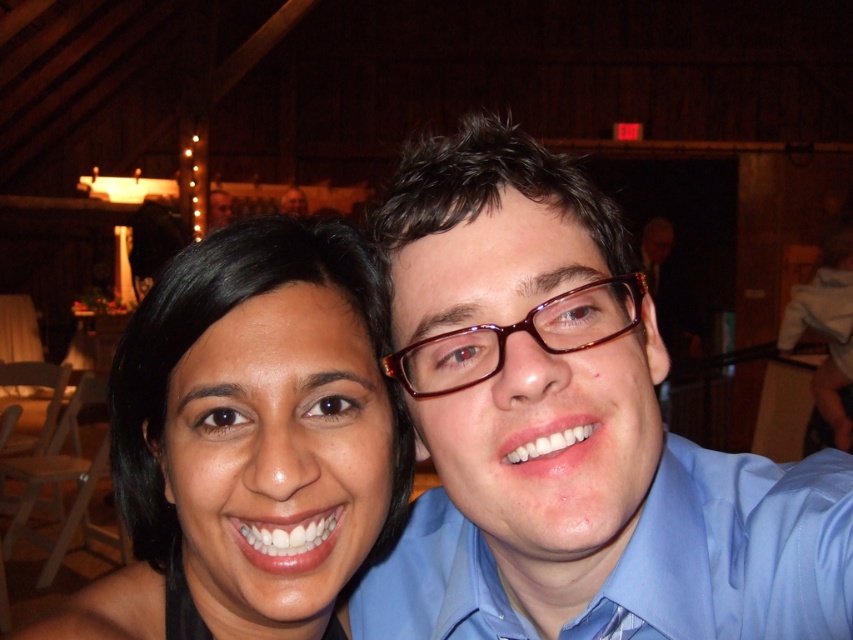
Is smooth skin face at center above shiny brown glasses at center?

Actually, smooth skin face at center is below shiny brown glasses at center.

Does smooth skin face at center lie in front of shiny brown glasses at center?

No, smooth skin face at center is further to the viewer.

What do you see at coordinates (250, 440) in the screenshot? I see `smooth skin face at center` at bounding box center [250, 440].

The height and width of the screenshot is (640, 853). What are the coordinates of `smooth skin face at center` in the screenshot? It's located at (250, 440).

Can you confirm if matte blue shirt at center is positioned above shiny brown glasses at center?

Incorrect, matte blue shirt at center is not positioned above shiny brown glasses at center.

Who is taller, matte blue shirt at center or shiny brown glasses at center?

matte blue shirt at center is taller.

Find the location of a particular element. This screenshot has height=640, width=853. matte blue shirt at center is located at coordinates [x=570, y=433].

Is point (566, 244) more distant than point (270, 596)?

No, it is in front of (270, 596).

Can you confirm if matte blue shirt at center is positioned above smooth skin face at center?

Yes.

Is point (560, 173) farther from camera compared to point (294, 589)?

Yes, point (560, 173) is farther from viewer.

Locate an element on the screen. This screenshot has width=853, height=640. matte blue shirt at center is located at coordinates (570, 433).